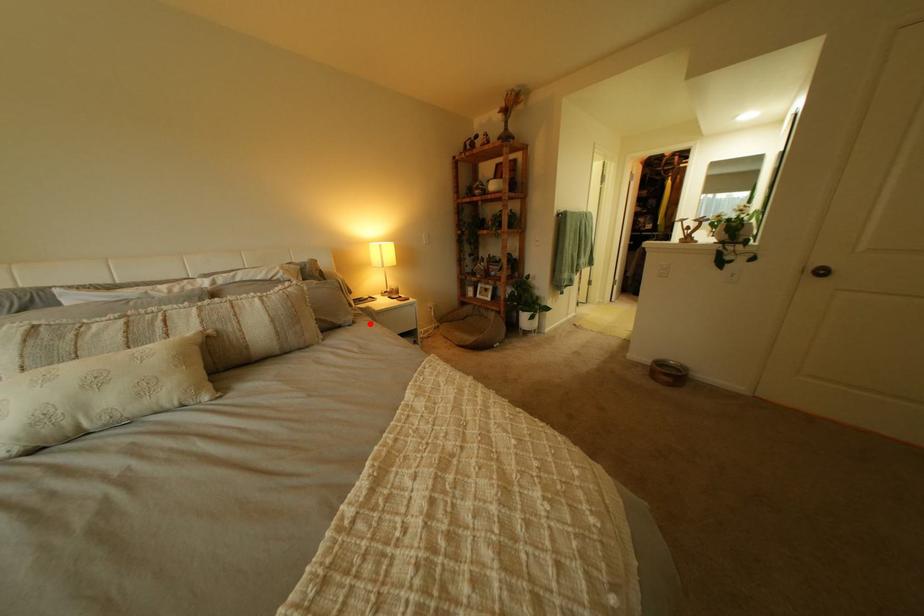
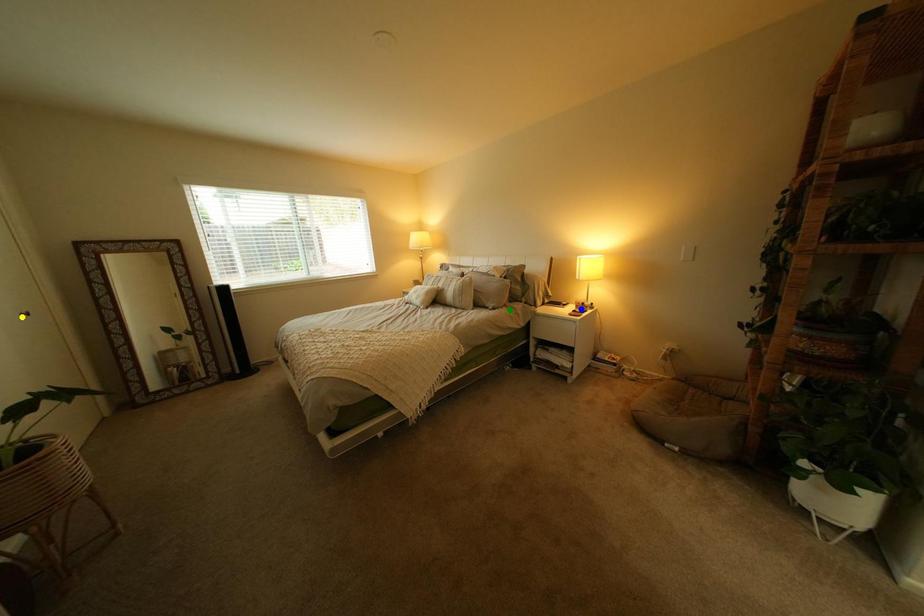
Question: I am providing you with two images of the same scene from different viewpoints. A red point is marked on the first image. You are given multiple points on the second image. Which mark in image 2 goes with the point in image 1?

Choices:
 (A) yellow point
 (B) green point
 (C) blue point

Answer: (B)